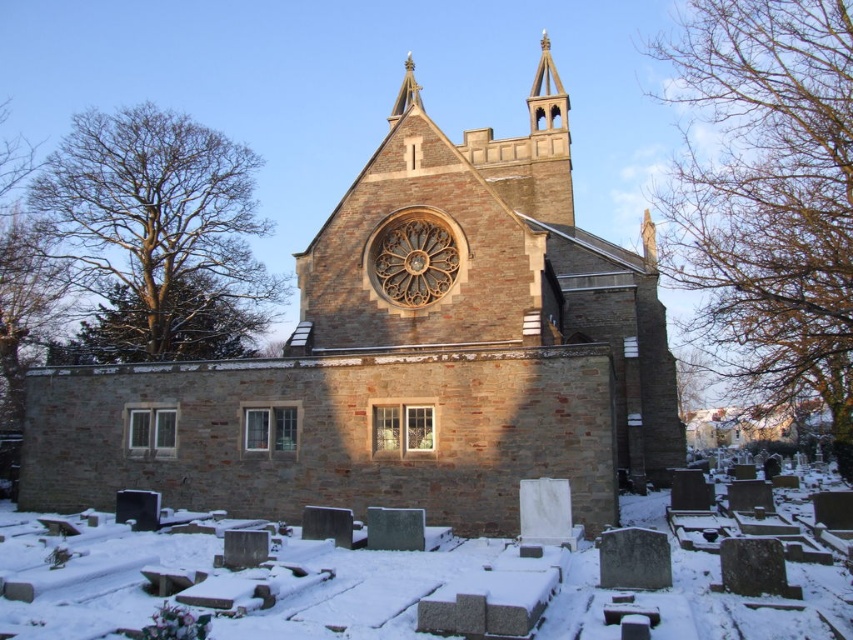
Does point (112, 397) come farther from viewer compared to point (421, 568)?

Yes.

Where is `brown stone church at center`? This screenshot has width=853, height=640. brown stone church at center is located at coordinates (402, 356).